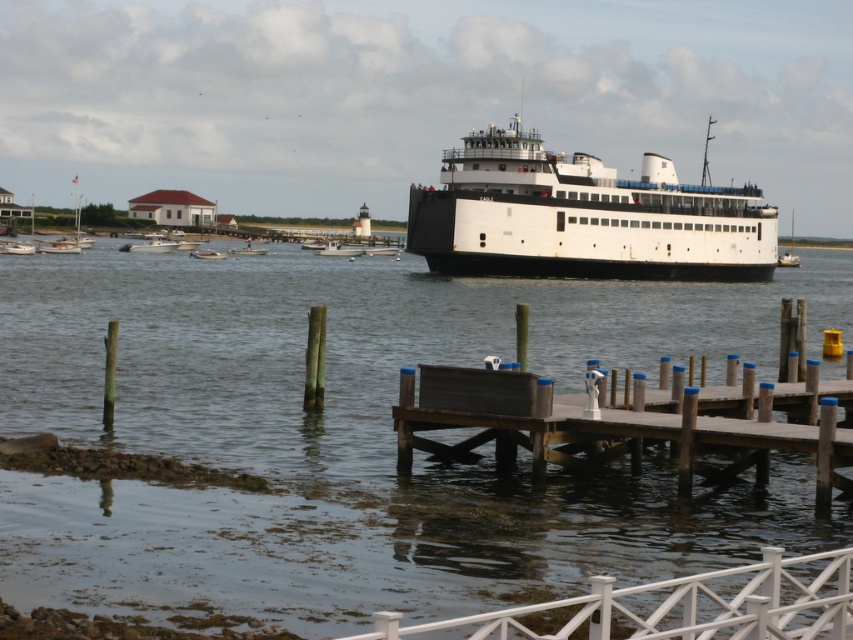
You are a passenger on the ferry and need to board a smaller vessel to reach the nearby island. Which vessel should you choose between the white matte boat at center and the metallic silver dinghy at center?

→ The metallic silver dinghy at center is smaller, so you should choose it to reach the nearby island.

You are a passenger on the ferry and want to board the metallic silver dinghy at center. Can you walk directly from the white matte boat at center to the dinghy without stepping off the boat?

The white matte boat at center is positioned over the metallic silver dinghy at center, so you can walk directly from the white matte boat at center to the dinghy without needing to step off the boat.

You are standing on the wooden pier and see the point marked at coordinates (582, 218). What object is located at that point?

The point at coordinates (582, 218) indicates the white matte ferry boat at upper center.